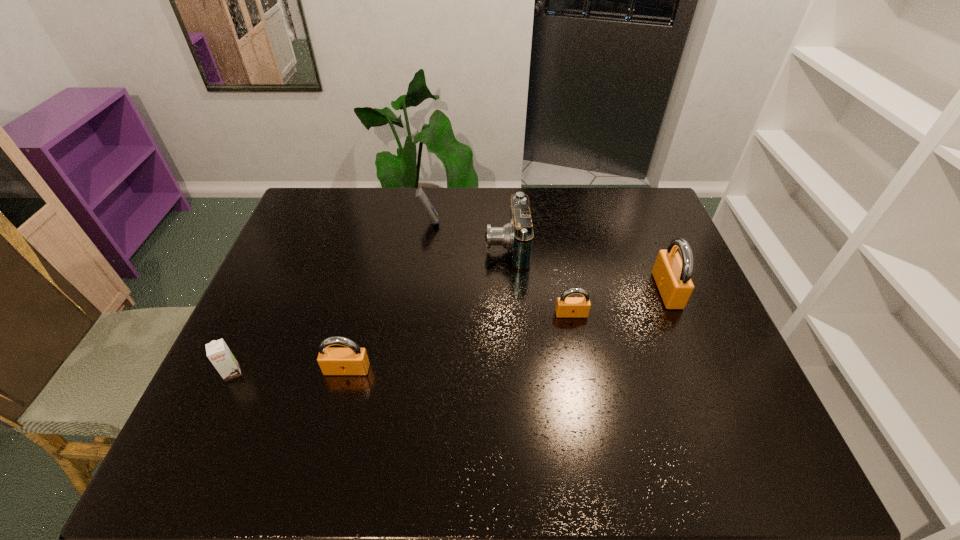
Point out which object is positioned as the nearest to the shortest padlock. Please provide its 2D coordinates. Your answer should be formatted as a tuple, i.e. [(x, y)], where the tuple contains the x and y coordinates of a point satisfying the conditions above.

[(516, 236)]

Where is `padlock that is the closest to the shortest padlock`? The width and height of the screenshot is (960, 540). padlock that is the closest to the shortest padlock is located at coordinates (672, 275).

Identify the location of padlock that is the second closest to the leftmost object. This screenshot has width=960, height=540. (566, 307).

Where is `vacant area in the image that satisfies the following two spatial constraints: 1. on the front-facing side of the third object from left to right; 2. to unlock the leftmost padlock from the front`? vacant area in the image that satisfies the following two spatial constraints: 1. on the front-facing side of the third object from left to right; 2. to unlock the leftmost padlock from the front is located at coordinates (409, 369).

This screenshot has height=540, width=960. Identify the location of free space that satisfies the following two spatial constraints: 1. on the front-facing side of the third object from left to right; 2. on the front side of the chocolate milk. (409, 373).

Identify the location of vacant area that satisfies the following two spatial constraints: 1. to unlock the tallest padlock from the front; 2. to unlock the leftmost padlock from the front. The image size is (960, 540). (700, 369).